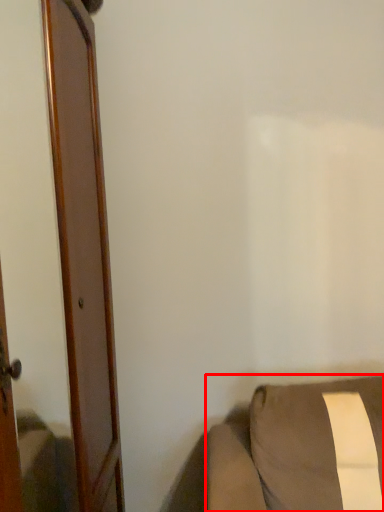
Question: From the image's perspective, what is the correct spatial positioning of furniture (annotated by the red box) in reference to door?

Choices:
 (A) above
 (B) below

Answer: (B)